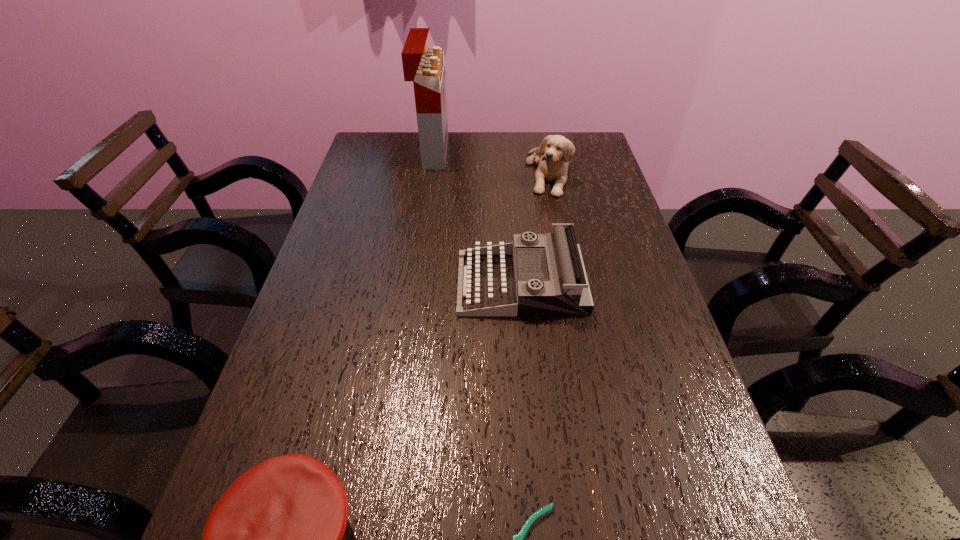
Where is `puppy present at the right edge`? This screenshot has height=540, width=960. puppy present at the right edge is located at coordinates (555, 151).

Where is `typewriter that is at the right edge`? typewriter that is at the right edge is located at coordinates [x=567, y=293].

The width and height of the screenshot is (960, 540). What are the coordinates of `object situated at the far right corner` in the screenshot? It's located at (555, 151).

In the image, there is a desktop. At what (x,y) coordinates should I click in order to perform the action: click on vacant space at the left edge. Please return your answer as a coordinate pair (x, y). The image size is (960, 540). Looking at the image, I should click on (375, 265).

Identify the location of vacant area at the right edge of the desktop. (671, 424).

This screenshot has height=540, width=960. In the image, there is a desktop. In order to click on vacant space at the far left corner in this screenshot , I will do `click(369, 166)`.

Select which object is the closest to the cap. Please provide its 2D coordinates. Your answer should be formatted as a tuple, i.e. [(x, y)], where the tuple contains the x and y coordinates of a point satisfying the conditions above.

[(519, 539)]

Select which object is the fourth closest to the cigarette case. Please provide its 2D coordinates. Your answer should be formatted as a tuple, i.e. [(x, y)], where the tuple contains the x and y coordinates of a point satisfying the conditions above.

[(519, 539)]